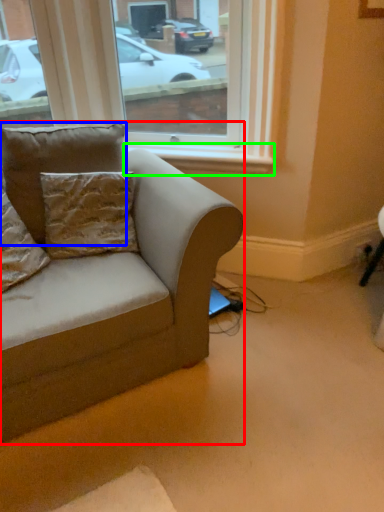
Question: Which is nearer to the studio couch (highlighted by a red box)? pillow (highlighted by a blue box) or window sill (highlighted by a green box).

Choices:
 (A) pillow
 (B) window sill

Answer: (A)